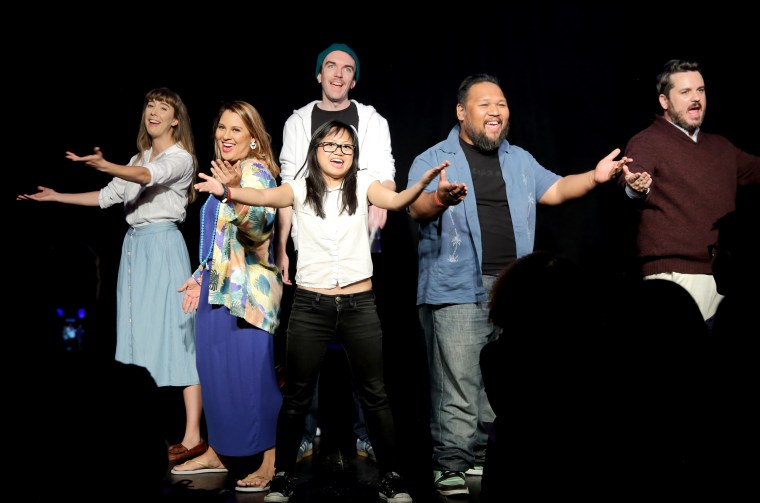
At what (x,y) coordinates should I click in order to perform the action: click on lights. Please return your answer as a coordinate pair (x, y). Looking at the image, I should click on point(83,313).